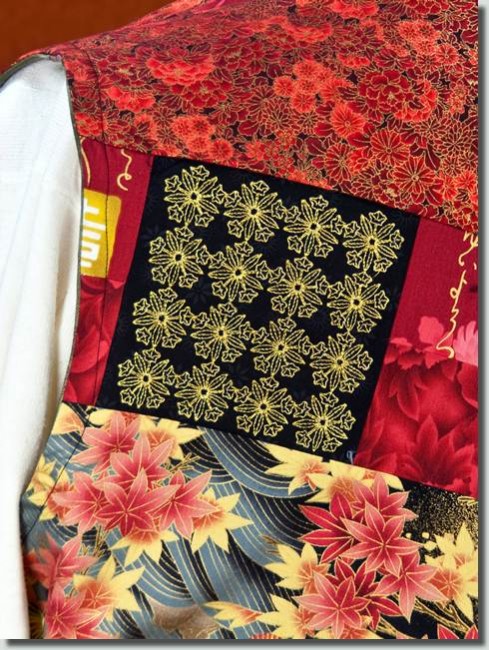
The height and width of the screenshot is (650, 489). I want to click on gap between pillow and pillow case, so click(25, 64).